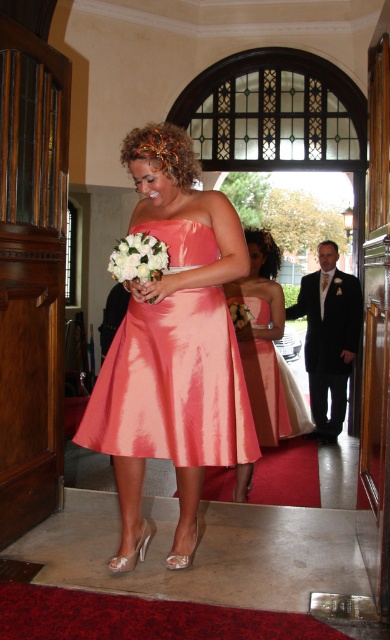
Question: Considering the relative positions of shiny coral dress at center and white silk bouquet at center in the image provided, where is shiny coral dress at center located with respect to white silk bouquet at center?

Choices:
 (A) right
 (B) left

Answer: (A)

Question: Does shiny coral dress at center have a lesser width compared to white silk bouquet at center?

Choices:
 (A) yes
 (B) no

Answer: (B)

Question: Is coral satin dress at center positioned in front of white silk bouquet at center?

Choices:
 (A) no
 (B) yes

Answer: (A)

Question: Among these objects, which one is farthest from the camera?

Choices:
 (A) white matte bouquet at center
 (B) shiny pink dress at center
 (C) coral satin dress at center
 (D) white silk bouquet at center

Answer: (A)

Question: Which of the following is the closest to the observer?

Choices:
 (A) (253, 353)
 (B) (242, 324)

Answer: (B)

Question: Which point is farther to the camera?

Choices:
 (A) (278, 426)
 (B) (235, 310)
 (C) (108, 268)

Answer: (A)